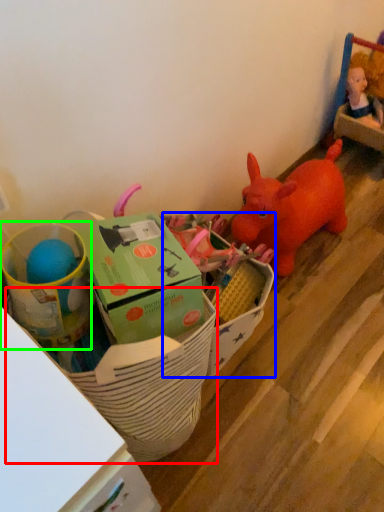
Question: Which is farther away from basket (highlighted by a red box)? storage box (highlighted by a blue box) or toy (highlighted by a green box)?

Choices:
 (A) storage box
 (B) toy

Answer: (A)